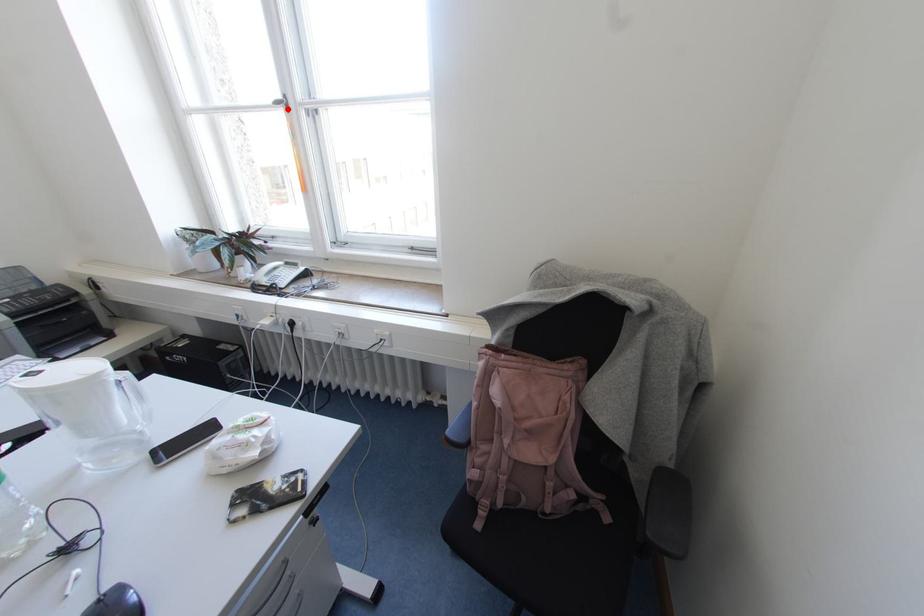
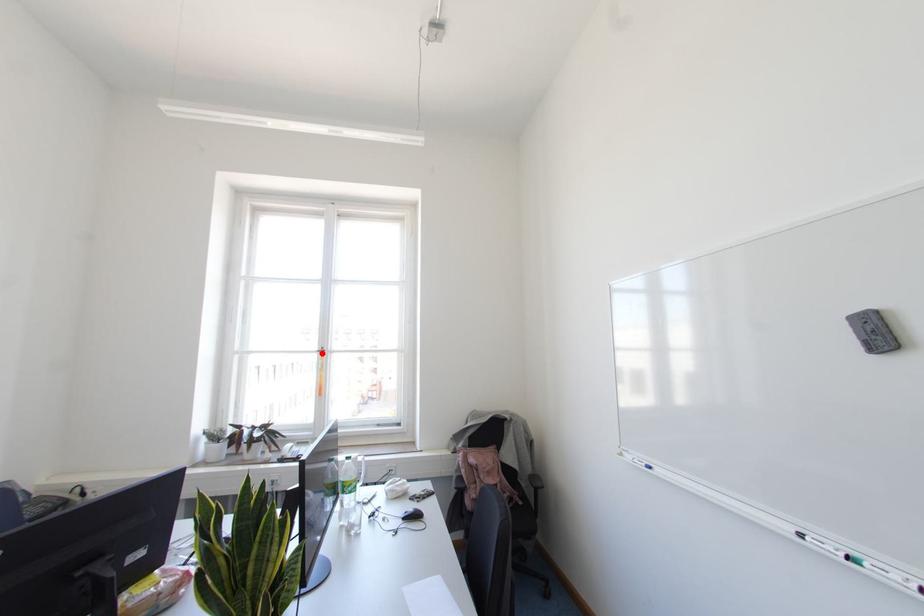
I am providing you with two images of the same scene from different viewpoints. A red point is marked on the first image and another point is marked on the second image. Do the highlighted points in image1 and image2 indicate the same real-world spot?

Yes